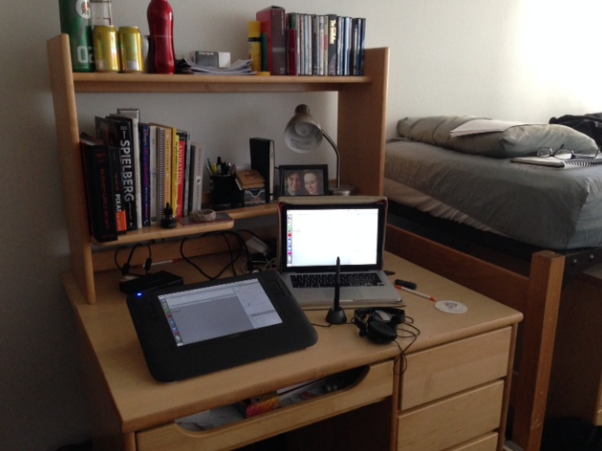
Where is `bed`? bed is located at coordinates (524, 186).